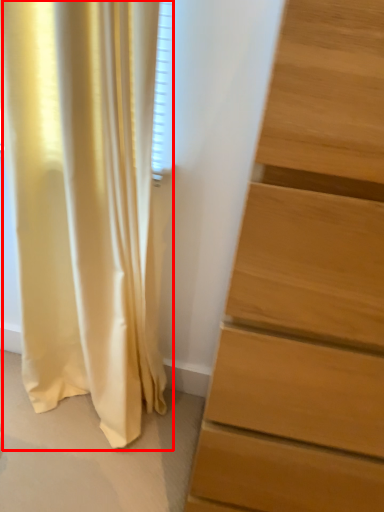
Question: From the image, what is the correct spatial relationship of curtain (annotated by the red box) in relation to chest of drawers?

Choices:
 (A) right
 (B) left

Answer: (B)